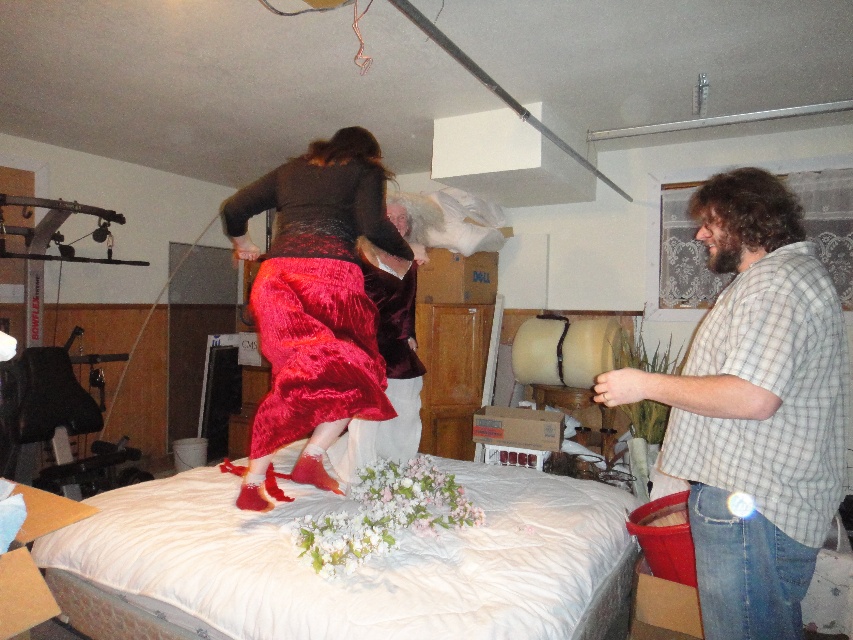
From the picture: Between white fabric bed at center and velvet red skirt at center, which one appears on the left side from the viewer's perspective?

From the viewer's perspective, velvet red skirt at center appears more on the left side.

What do you see at coordinates (363, 563) in the screenshot? The width and height of the screenshot is (853, 640). I see `white fabric bed at center` at bounding box center [363, 563].

Between point (587, 547) and point (317, 248), which one is positioned behind?

Point (587, 547)

Locate an element on the screen. This screenshot has height=640, width=853. white fabric bed at center is located at coordinates pos(363,563).

Can you confirm if white fabric bed at center is taller than checkered shirt at right?

No, white fabric bed at center is not taller than checkered shirt at right.

The image size is (853, 640). Describe the element at coordinates (363, 563) in the screenshot. I see `white fabric bed at center` at that location.

Find the location of a particular element. The height and width of the screenshot is (640, 853). white fabric bed at center is located at coordinates (363, 563).

I want to click on white fabric bed at center, so click(363, 563).

Can you confirm if checkered shirt at right is positioned to the left of velvet red skirt at center?

In fact, checkered shirt at right is to the right of velvet red skirt at center.

Does point (757, 465) come farther from viewer compared to point (352, 216)?

No, it is in front of (352, 216).

Does point (820, 269) lie in front of point (264, 260)?

Yes, point (820, 269) is closer to viewer.

Where is `checkered shirt at right`? Image resolution: width=853 pixels, height=640 pixels. checkered shirt at right is located at coordinates (753, 410).